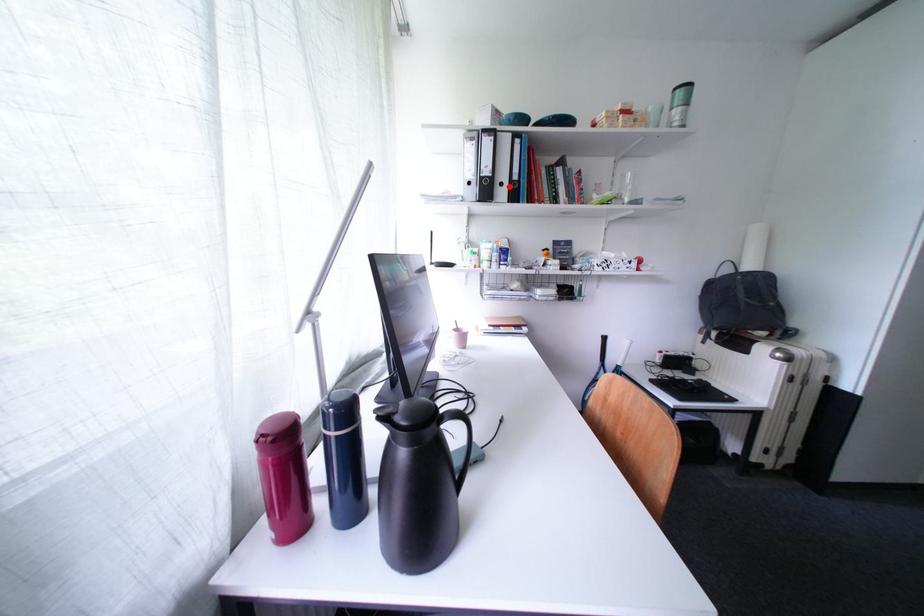
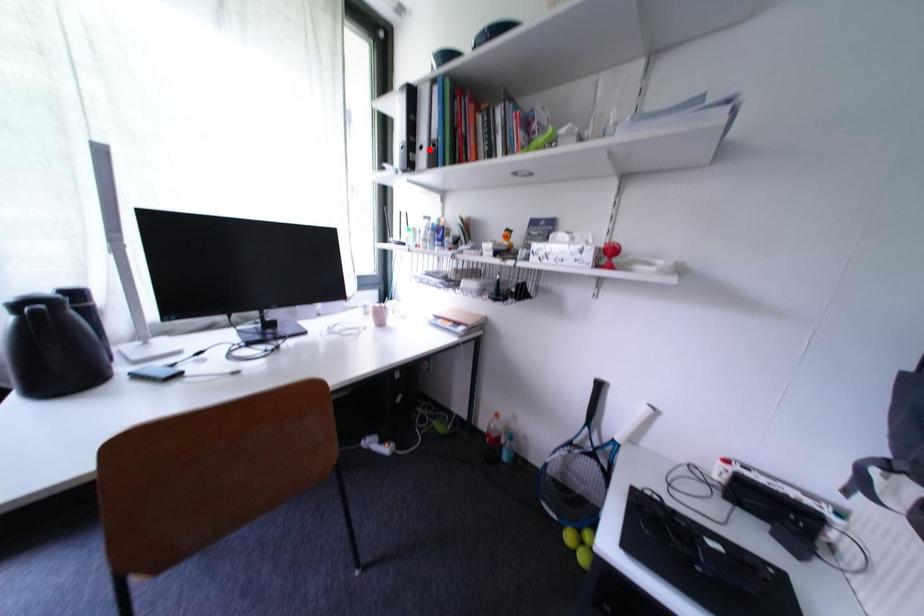
I am providing you with two images of the same scene from different viewpoints. A red point is marked on the first image and another point is marked on the second image. Are the points marked in image1 and image2 representing the same 3D position?

Yes